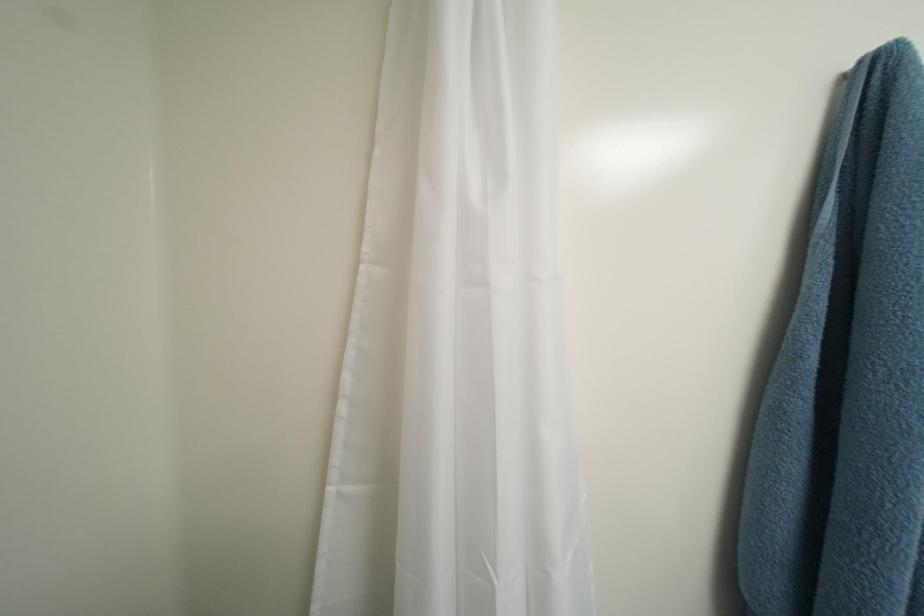
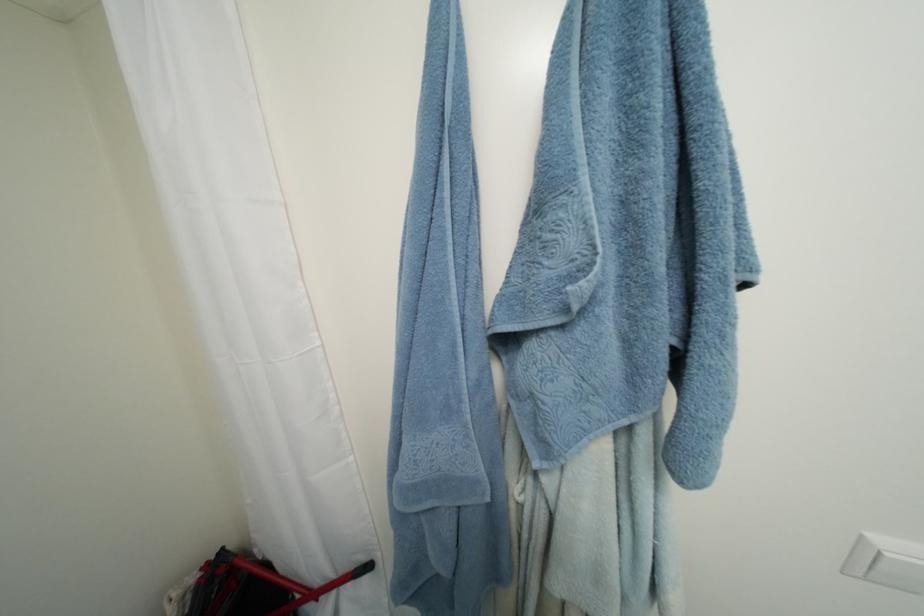
Question: The images are taken continuously from a first-person perspective. In which direction are you moving?

Choices:
 (A) Left
 (B) Right
 (C) Forward
 (D) Backward

Answer: (B)